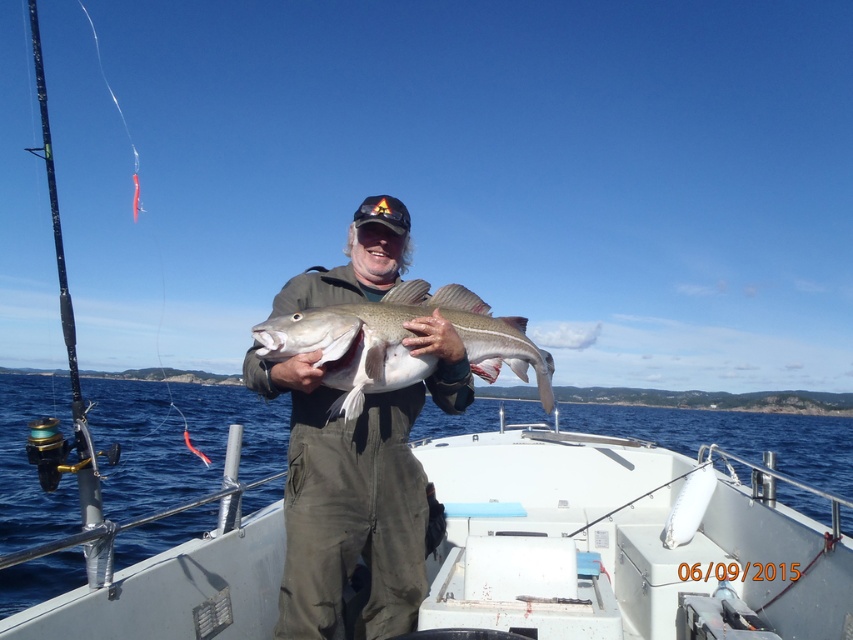
You are a photographer trying to capture the fisherman holding the cod. The point at coordinates point (357, 490) is part of an object in the scene. Which object is this point located on?

The point (357, 490) is located on the dark green corduroy overalls at center.

You are standing on the white plastic boat at center and want to place the silver metallic fish at center on the boat. Considering the height difference between the boat and the fish, will the fish fit vertically on the boat without exceeding its height?

The white plastic boat at center has a greater height compared to the silver metallic fish at center, so the fish will fit vertically on the boat without exceeding its height.